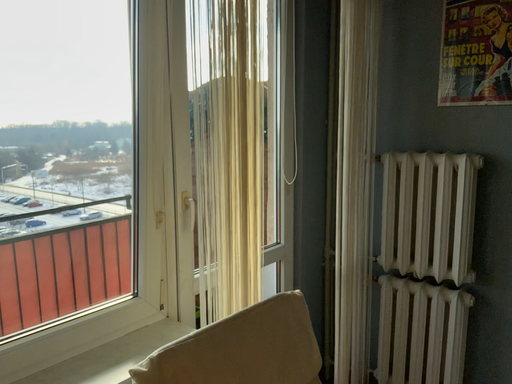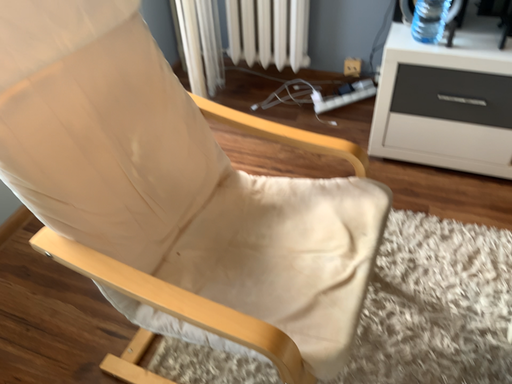
Question: Which way did the camera rotate in the video?

Choices:
 (A) rotated upward
 (B) rotated downward

Answer: (B)